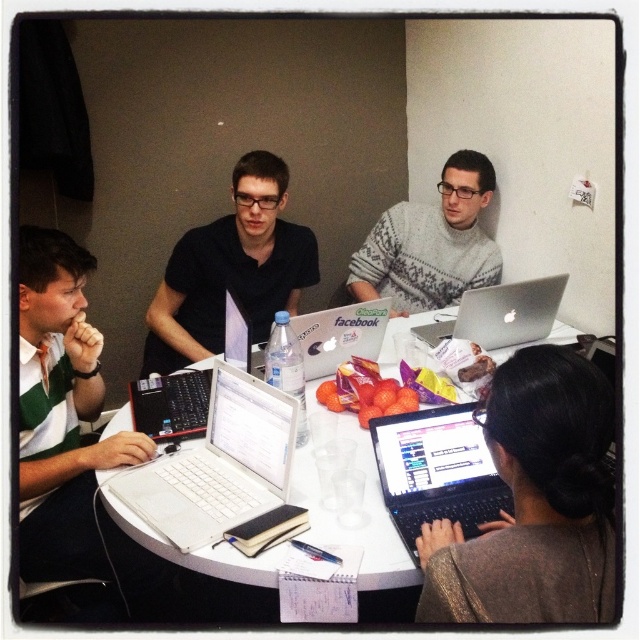
In the scene shown: You are organizing a presentation and need to place the white matte laptop at center and the gray knitted sweater at center on a small desk. Which object should you place first to ensure both fit comfortably?

The white matte laptop at center has a smaller width than the gray knitted sweater at center, so you should place the gray knitted sweater at center first to ensure both fit comfortably on the desk.

You are a photographer positioned behind the group and want to capture a clear photo of both the green striped polo shirt at left and the gray knitted sweater at center. Which person should you focus on first to ensure both are in sharp focus?

You should focus on the green striped polo shirt at left first because it is closer to the viewer than the gray knitted sweater at center. By focusing on the closer object, the depth of field may extend to include the farther one, ensuring both are in focus.

You are planning to place a gray knitted sweater at center on the white plastic table at center. Based on the size comparison between them, will the sweater fit entirely on the table?

The white plastic table at center is larger in size than the gray knitted sweater at center, so the sweater will fit entirely on the table.